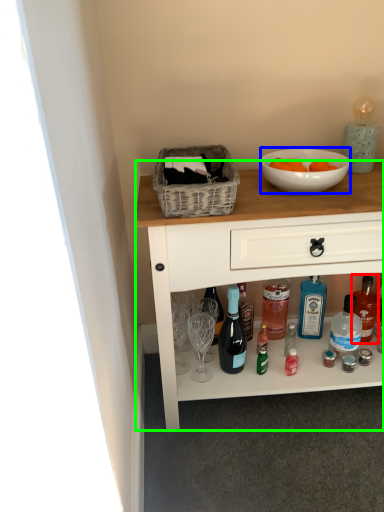
Question: Considering the real-world distances, which object is closest to bottle (highlighted by a red box)? bowl (highlighted by a blue box) or desk (highlighted by a green box).

Choices:
 (A) bowl
 (B) desk

Answer: (B)